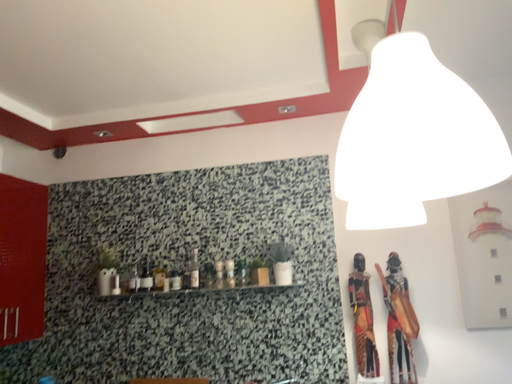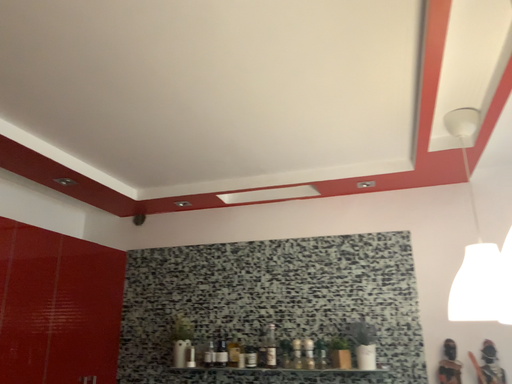
Question: How did the camera likely rotate when shooting the video?

Choices:
 (A) rotated upward
 (B) rotated downward

Answer: (A)